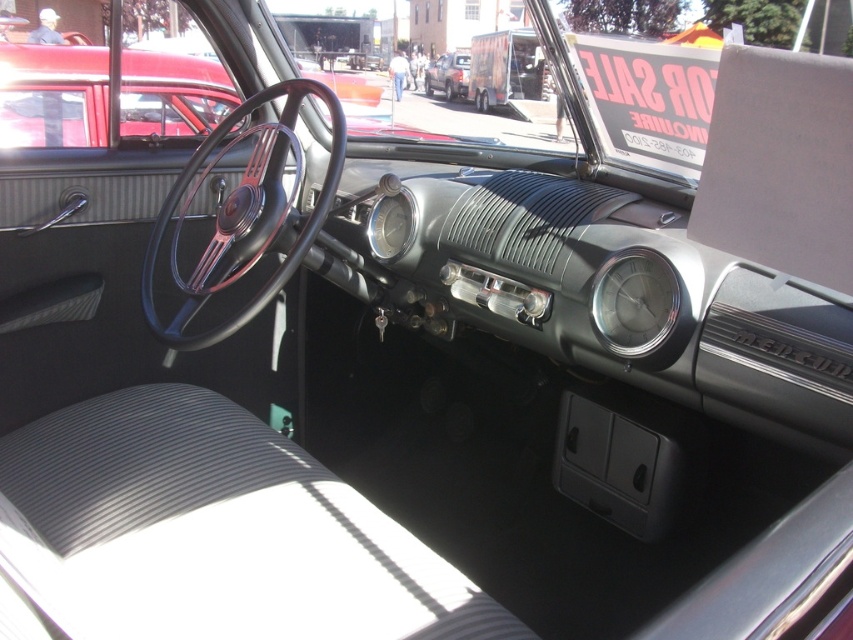
Is point (656, 339) closer to viewer compared to point (457, 92)?

Yes.

Can you confirm if metallic silver clock at center is positioned above matte black truck at center?

No.

Measure the distance between point [612,275] and camera.

Point [612,275] and camera are 1.56 meters apart.

The image size is (853, 640). I want to click on metallic silver clock at center, so click(x=635, y=301).

From the picture: Is black leather steering wheel at center positioned before metallic silver clock at center?

No, black leather steering wheel at center is behind metallic silver clock at center.

Is black leather steering wheel at center to the left of metallic silver clock at center from the viewer's perspective?

Indeed, black leather steering wheel at center is positioned on the left side of metallic silver clock at center.

Is point (219, 154) farther from viewer compared to point (625, 269)?

Yes, point (219, 154) is farther from viewer.

Find the location of a particular element. Image resolution: width=853 pixels, height=640 pixels. black leather steering wheel at center is located at coordinates (244, 212).

Is black leather steering wheel at center thinner than matte black truck at center?

Yes.

Is point (144, 282) behind point (466, 65)?

No, it is in front of (466, 65).

Which is behind, point (141, 280) or point (440, 83)?

Positioned behind is point (440, 83).

Where is `black leather steering wheel at center`? black leather steering wheel at center is located at coordinates (244, 212).